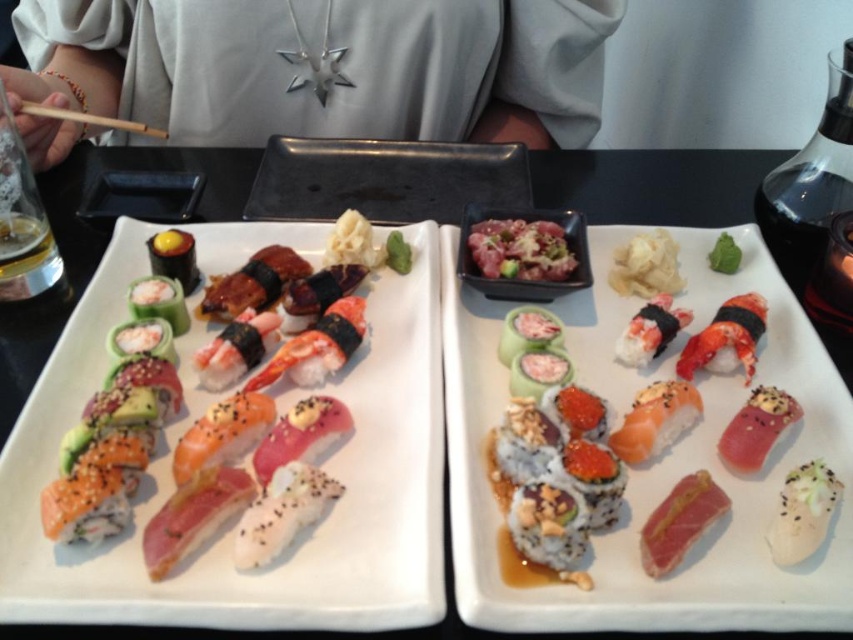
Question: Observing the image, what is the correct spatial positioning of black ceramic tray at center in reference to shiny pink salmon at center right?

Choices:
 (A) above
 (B) below

Answer: (A)

Question: Can you confirm if sushi at center is positioned to the left of white crumbly bread at center?

Choices:
 (A) no
 (B) yes

Answer: (B)

Question: Which of these objects is positioned farthest from the shiny pink salmon at center right?

Choices:
 (A) white crumbly bread at center
 (B) black ceramic tray at center

Answer: (B)

Question: Which point is closer to the camera taking this photo?

Choices:
 (A) (721, 259)
 (B) (360, 248)

Answer: (B)

Question: Can you confirm if shiny pink salmon at center right is bigger than smooth black sushi at upper left?

Choices:
 (A) yes
 (B) no

Answer: (A)

Question: Which point is farther to the camera?

Choices:
 (A) (631, 320)
 (B) (148, 116)

Answer: (B)